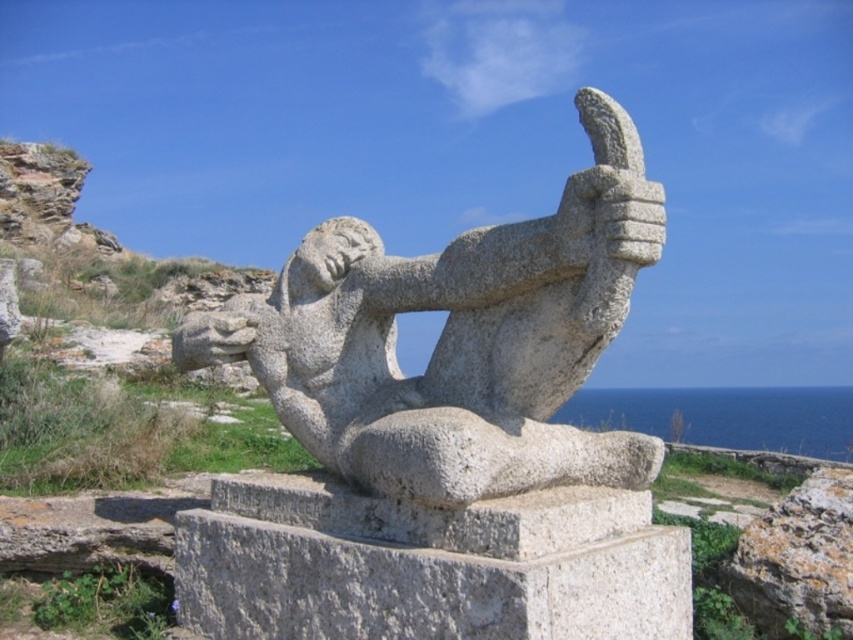
Question: Which point is farther from the camera taking this photo?

Choices:
 (A) (403, 477)
 (B) (840, 604)

Answer: (B)

Question: Does granite statue at center have a larger size compared to granite rock at lower right?

Choices:
 (A) yes
 (B) no

Answer: (A)

Question: Is granite statue at center closer to the viewer compared to granite rock at lower right?

Choices:
 (A) no
 (B) yes

Answer: (B)

Question: Can you confirm if granite statue at center is wider than granite rock at lower right?

Choices:
 (A) yes
 (B) no

Answer: (A)